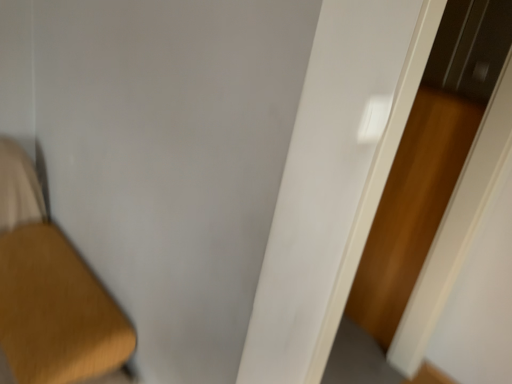
Question: Does wooden screen door at right have a larger size compared to white glossy door at center?

Choices:
 (A) yes
 (B) no

Answer: (B)

Question: From the image's perspective, is wooden screen door at right on top of white glossy door at center?

Choices:
 (A) no
 (B) yes

Answer: (B)

Question: Considering the relative sizes of wooden screen door at right and white glossy door at center in the image provided, is wooden screen door at right wider than white glossy door at center?

Choices:
 (A) no
 (B) yes

Answer: (B)

Question: Does wooden screen door at right have a greater height compared to white glossy door at center?

Choices:
 (A) yes
 (B) no

Answer: (B)

Question: Considering the relative sizes of wooden screen door at right and white glossy door at center in the image provided, is wooden screen door at right thinner than white glossy door at center?

Choices:
 (A) no
 (B) yes

Answer: (A)

Question: Is wooden screen door at right outside of white glossy door at center?

Choices:
 (A) no
 (B) yes

Answer: (B)

Question: From the image's perspective, is white glossy door at center located beneath wooden screen door at right?

Choices:
 (A) yes
 (B) no

Answer: (A)

Question: Does white glossy door at center appear on the right side of wooden screen door at right?

Choices:
 (A) no
 (B) yes

Answer: (A)

Question: Could you tell me if white glossy door at center is facing wooden screen door at right?

Choices:
 (A) no
 (B) yes

Answer: (A)

Question: Is white glossy door at center closer to the viewer compared to wooden screen door at right?

Choices:
 (A) no
 (B) yes

Answer: (B)

Question: Is white glossy door at center completely or partially outside of wooden screen door at right?

Choices:
 (A) no
 (B) yes

Answer: (B)

Question: From the image's perspective, is white glossy door at center on top of wooden screen door at right?

Choices:
 (A) yes
 (B) no

Answer: (B)

Question: Based on their positions, is white glossy door at center located to the left or right of wooden screen door at right?

Choices:
 (A) right
 (B) left

Answer: (B)